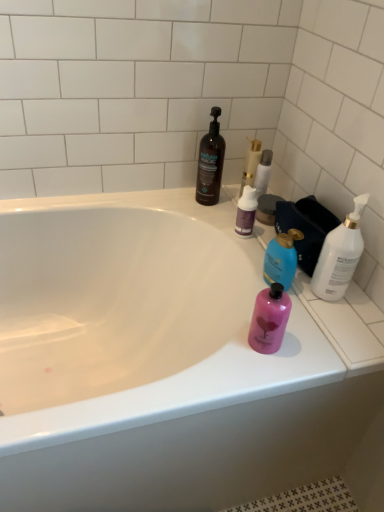
Identify the location of vacant area to the left of gold metallic candle at upper center. The image size is (384, 512). click(x=215, y=195).